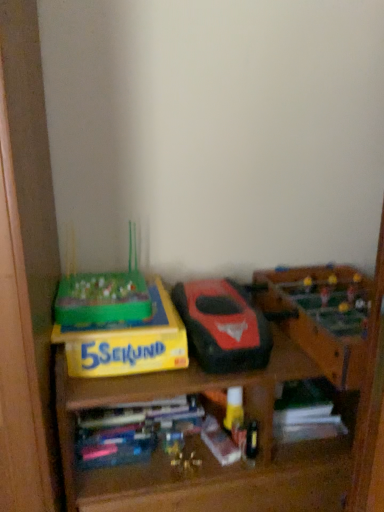
Locate an element on the screen. free space above matte black toy car at center, arranged as the second toy when viewed from the right (from a real-world perspective) is located at coordinates (211, 290).